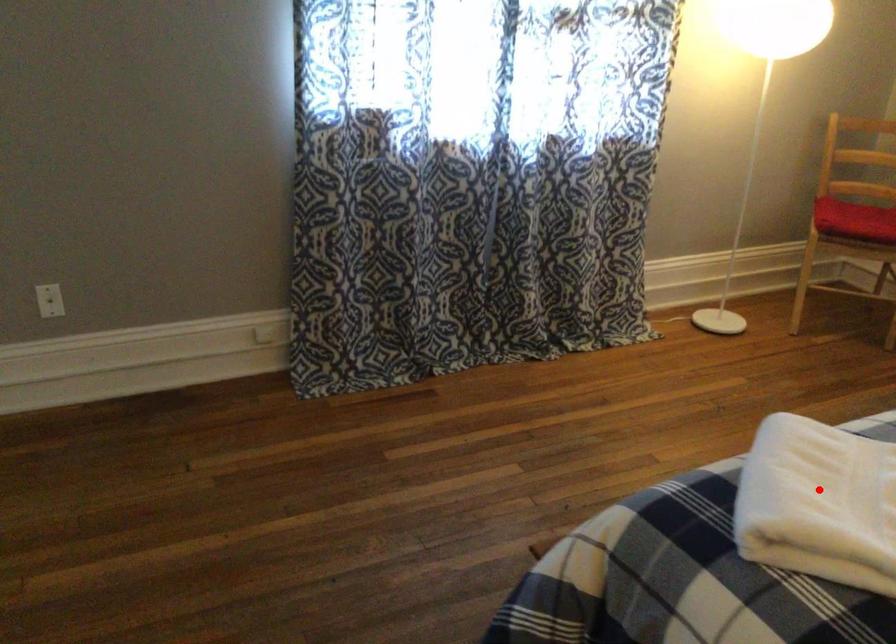
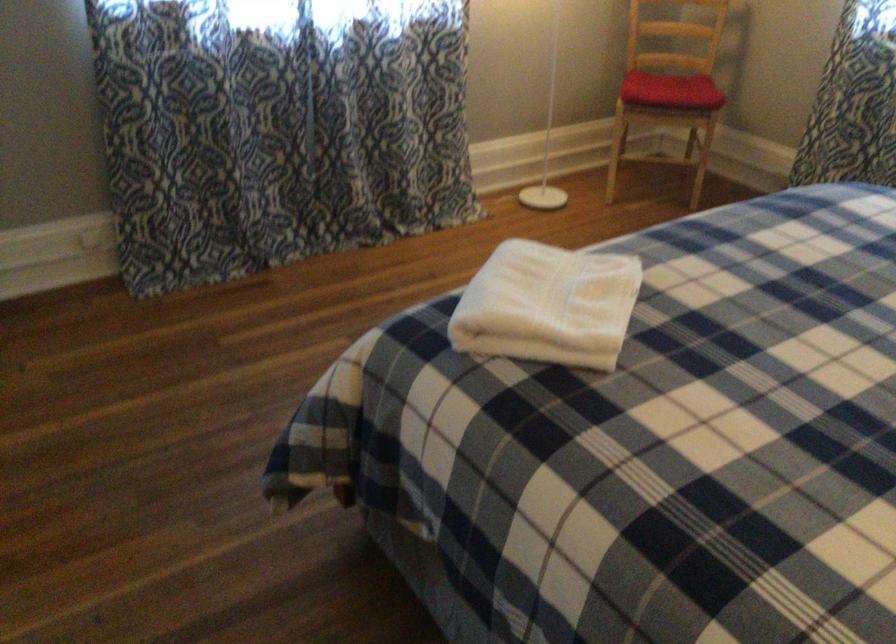
Question: I am providing you with two images of the same scene from different viewpoints. Given a red point in image1, look at the same physical point in image2. Is it:

Choices:
 (A) Closer to the viewpoint
 (B) Farther from the viewpoint

Answer: (B)